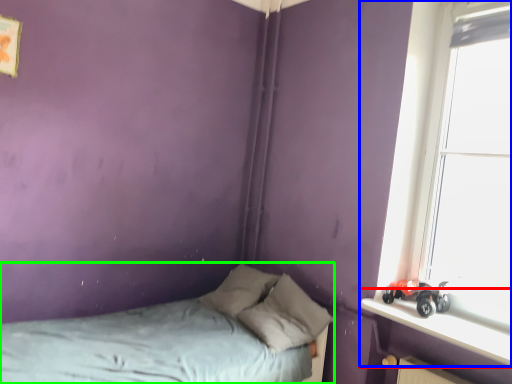
Question: Which object is the farthest from window sill (highlighted by a red box)? Choose among these: window (highlighted by a blue box) or bed (highlighted by a green box).

Choices:
 (A) window
 (B) bed

Answer: (B)